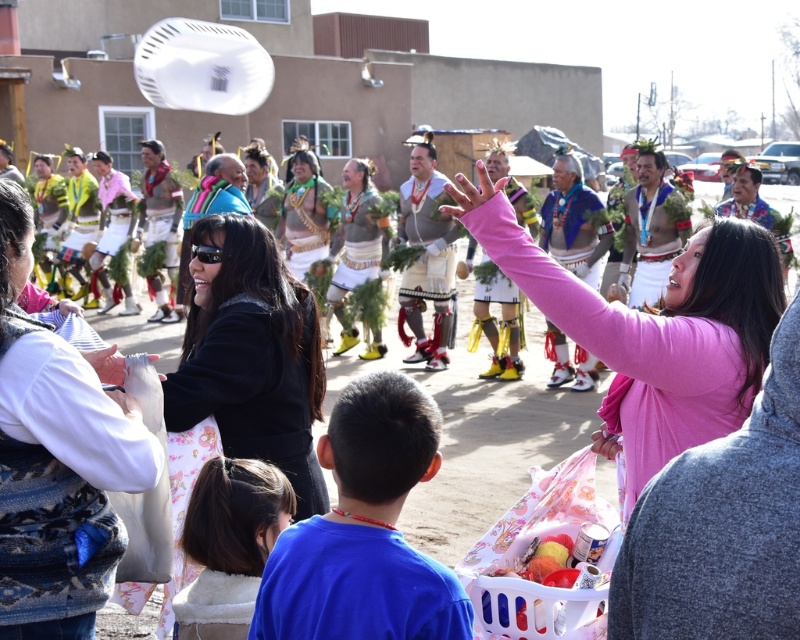
You are at a cultural event and see the pink matte shirt at center and the white fluffy blanket at lower left. Which object is located more to the right side?

The pink matte shirt at center is positioned on the right side of white fluffy blanket at lower left, so it is more to the right.

You are a photographer at this event and want to capture a photo that includes both the white woven blanket at upper left and the pink matte shirt at center. However, your camera has a limited focus range. Based on their sizes in the image, which object should you prioritize focusing on to ensure it appears sharp?

The white woven blanket at upper left is much taller than the pink matte shirt at center, so you should prioritize focusing on the white woven blanket at upper left since it is larger and might require more precise focus to capture details.

You are a photographer at this event and want to capture a photo that includes both the white woven fabric at center and the white fluffy blanket at lower left. What is the minimum distance you need to move backward to ensure both objects are in frame?

The distance between the white woven fabric at center and the white fluffy blanket at lower left is 9.52 meters. To include both in the photo, you need to move back at least 9.52 meters to ensure both are within the camera frame.